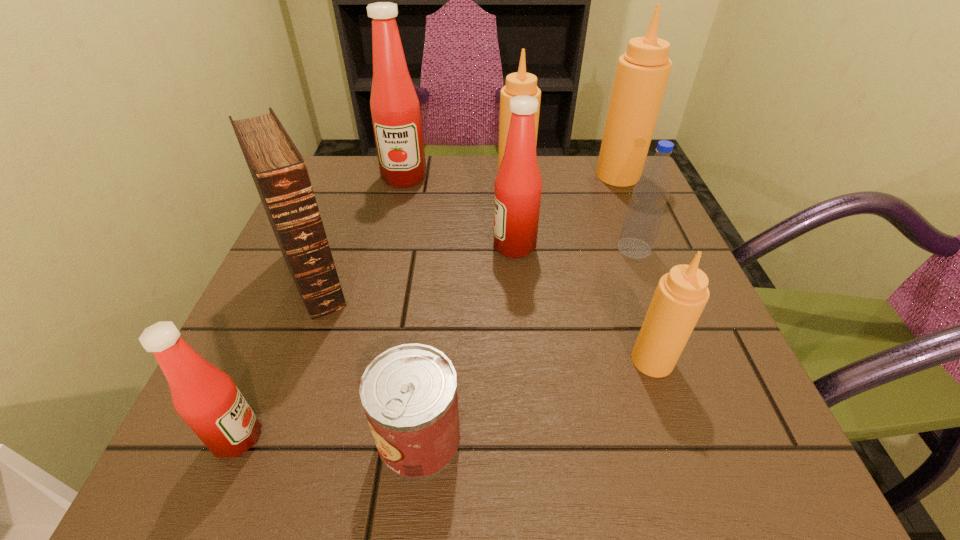
Find the location of `the biggest tan condiment`. the biggest tan condiment is located at coordinates (642, 73).

Where is `the farthest red condiment`? This screenshot has width=960, height=540. the farthest red condiment is located at coordinates (395, 109).

At what (x,y) coordinates should I click in order to perform the action: click on the biggest red condiment. Please return your answer as a coordinate pair (x, y). Looking at the image, I should click on (395, 109).

What are the coordinates of `the leftmost tan condiment` in the screenshot? It's located at (520, 83).

Where is `the second biggest red condiment`? This screenshot has height=540, width=960. the second biggest red condiment is located at coordinates (518, 185).

Find the location of a particular element. The height and width of the screenshot is (540, 960). the second nearest red condiment is located at coordinates (518, 185).

Identify the location of Bible. (279, 172).

Identify the location of blue water bottle. (644, 214).

The image size is (960, 540). In order to click on the smallest tan condiment in this screenshot , I will do (681, 295).

The image size is (960, 540). Identify the location of the second nearest condiment. (681, 295).